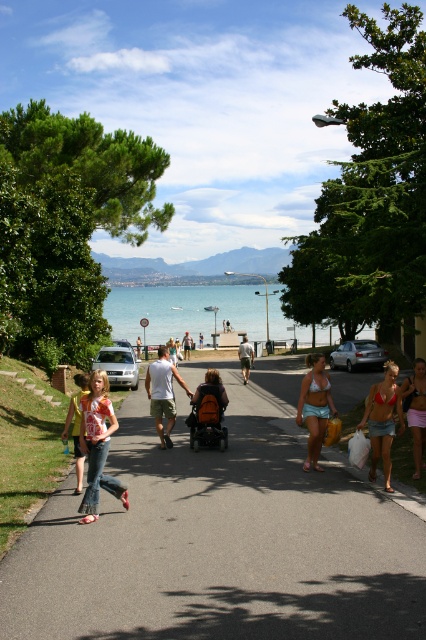
Question: Is beige denim shorts at lower right in front of orange fabric stroller at center?

Choices:
 (A) yes
 (B) no

Answer: (A)

Question: Which point appears farthest from the camera in this image?

Choices:
 (A) (256, 298)
 (B) (85, 440)
 (C) (224, 429)
 (D) (359, 426)

Answer: (A)

Question: Estimate the real-world distances between objects in this image. Which object is closer to the matte black tank top at center?

Choices:
 (A) orange fabric stroller at center
 (B) denim jeans at left
 (C) beige denim shorts at lower right
 (D) blue water at center

Answer: (C)

Question: Is the position of blue water at center less distant than that of teal fabric bikini top at center?

Choices:
 (A) yes
 (B) no

Answer: (B)

Question: Does blue water at center have a larger size compared to beige denim shorts at lower right?

Choices:
 (A) no
 (B) yes

Answer: (B)

Question: Which point is farther from the camera taking this photo?

Choices:
 (A) (215, 397)
 (B) (311, 381)

Answer: (A)